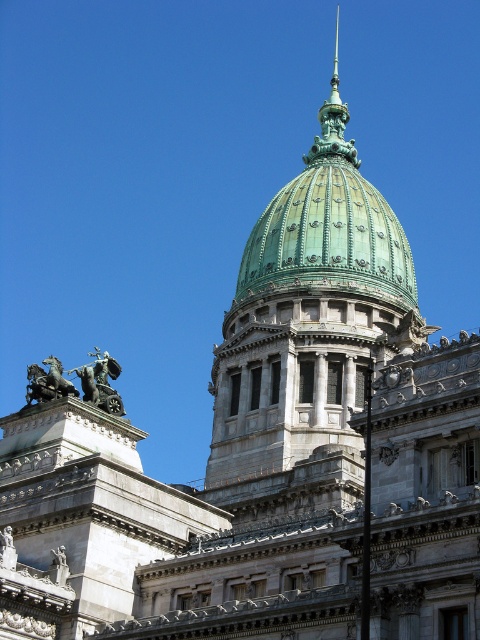
Question: Does bronze statue at upper left appear under bronze/golden statue of horses at upper left?

Choices:
 (A) yes
 (B) no

Answer: (A)

Question: Which point is farther to the camera?

Choices:
 (A) (48, 381)
 (B) (107, 410)
 (C) (268, 291)

Answer: (C)

Question: Which point is farther to the camera?

Choices:
 (A) bronze statue at upper left
 (B) green patina dome at center

Answer: (B)

Question: Does green patina dome at center come in front of bronze statue at upper left?

Choices:
 (A) no
 (B) yes

Answer: (A)

Question: Is green polished dome at center wider than bronze/golden statue of horses at upper left?

Choices:
 (A) no
 (B) yes

Answer: (B)

Question: Which is farther from the green polished dome at center?

Choices:
 (A) bronze statue at upper left
 (B) green patina dome at center
 (C) bronze/golden statue of horses at upper left

Answer: (C)